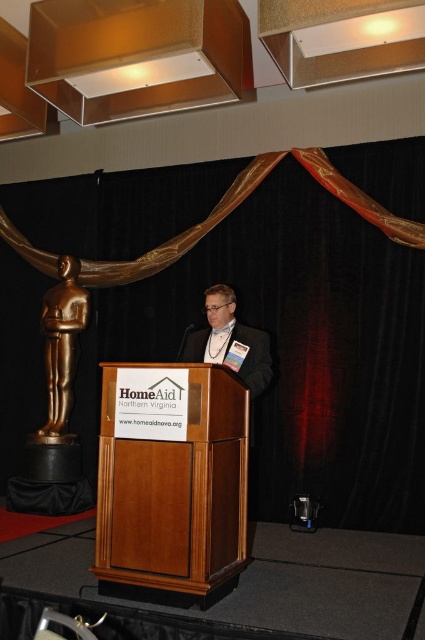
Between wooden podium at center and matte black suit at center, which one has more height?

With more height is wooden podium at center.

Image resolution: width=425 pixels, height=640 pixels. Find the location of `wooden podium at center`. wooden podium at center is located at coordinates (175, 497).

Is gold polished statue at left taller than matte black suit at center?

Yes.

Which is more to the right, gold polished statue at left or matte black suit at center?

matte black suit at center is more to the right.

What do you see at coordinates (62, 342) in the screenshot?
I see `gold polished statue at left` at bounding box center [62, 342].

The height and width of the screenshot is (640, 425). Identify the location of gold polished statue at left. (62, 342).

What do you see at coordinates (297, 349) in the screenshot? I see `matte gold fabric at upper center` at bounding box center [297, 349].

Is point (408, 148) positioned in front of point (73, 264)?

Yes, point (408, 148) is in front of point (73, 264).

Is point (289, 188) more distant than point (45, 355)?

No, it is not.

Where is `matte gold fabric at upper center`? matte gold fabric at upper center is located at coordinates (297, 349).